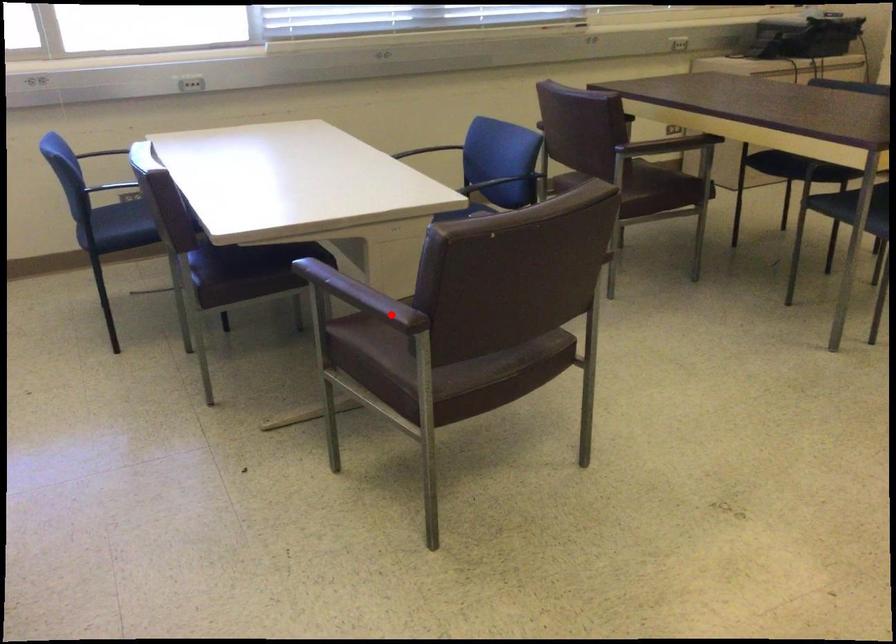
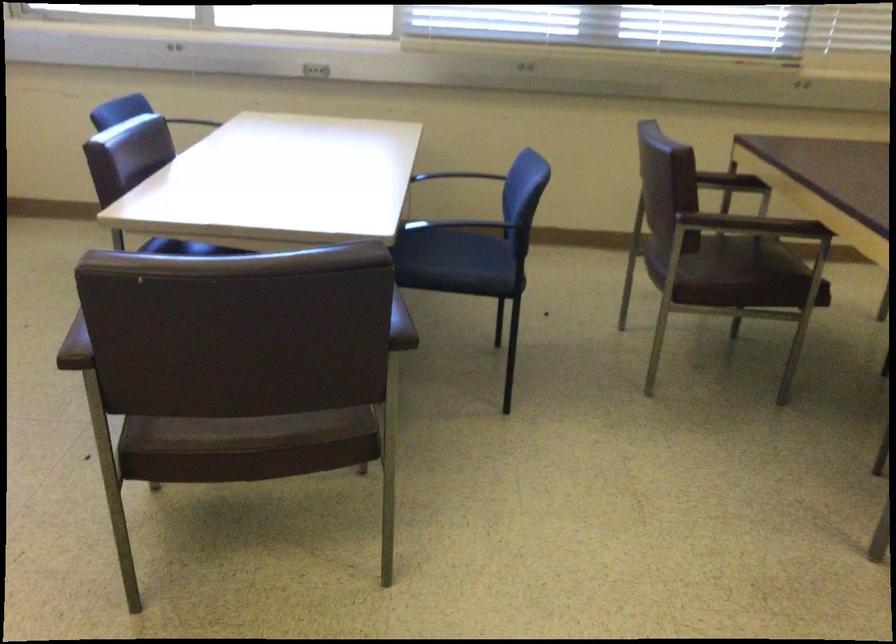
Question: I am providing you with two images of the same scene from different viewpoints. Image1 has a red point marked. In image2, the corresponding 3D location appears at what relative position? Reply with the corresponding letter.

Choices:
 (A) Closer
 (B) Farther

Answer: (A)